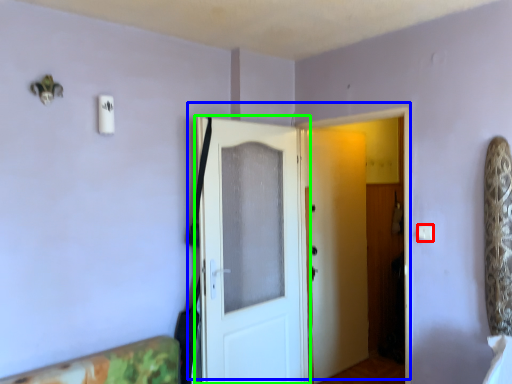
Question: Which object is positioned farthest from light switch (highlighted by a red box)? Select from door (highlighted by a blue box) and door (highlighted by a green box).

Choices:
 (A) door
 (B) door

Answer: (B)